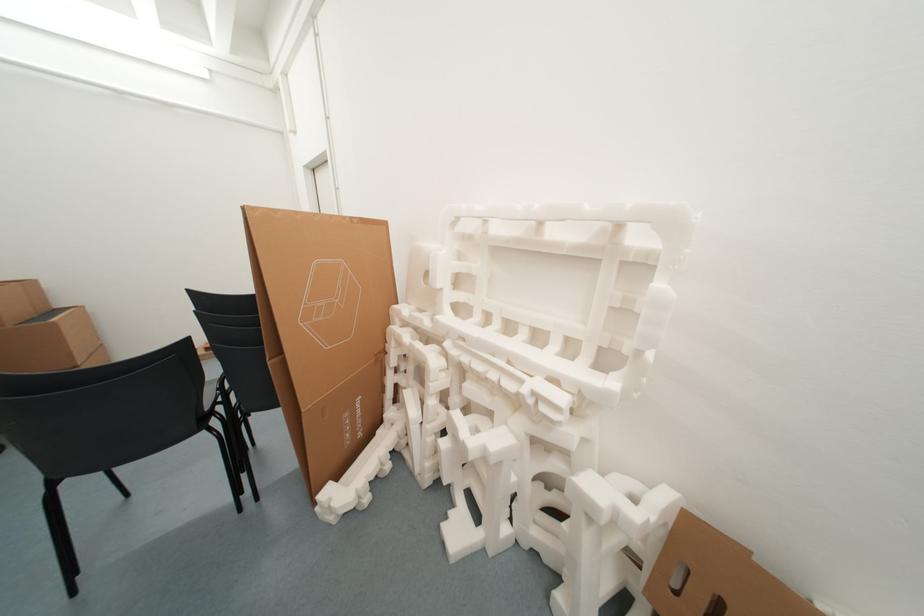
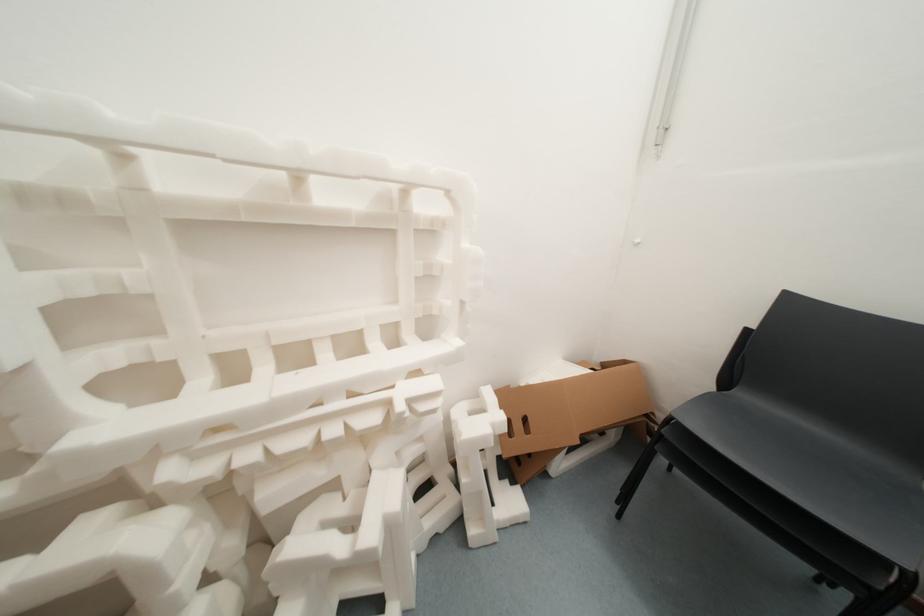
First-person continuous shooting, in which direction is the camera rotating?

The camera rotated toward right-down.